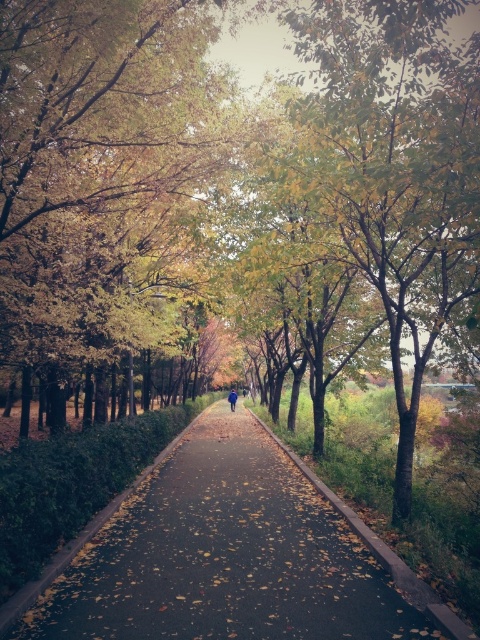
From the picture: You are standing at the start of the dark asphalt path at center and want to walk to a bench located 15 feet away from where you are standing. Can you reach the bench before the path curves to the right?

The dark asphalt path at center is 14.54 feet away from camera, so yes, you can reach the bench before the path curves to the right since the bench is within the 14.54 feet distance.

You are a hiker walking along the pathway and notice both the golden leaves at center and the blue fabric jacket at center. Which object is taller?

The golden leaves at center are taller than the blue fabric jacket at center.